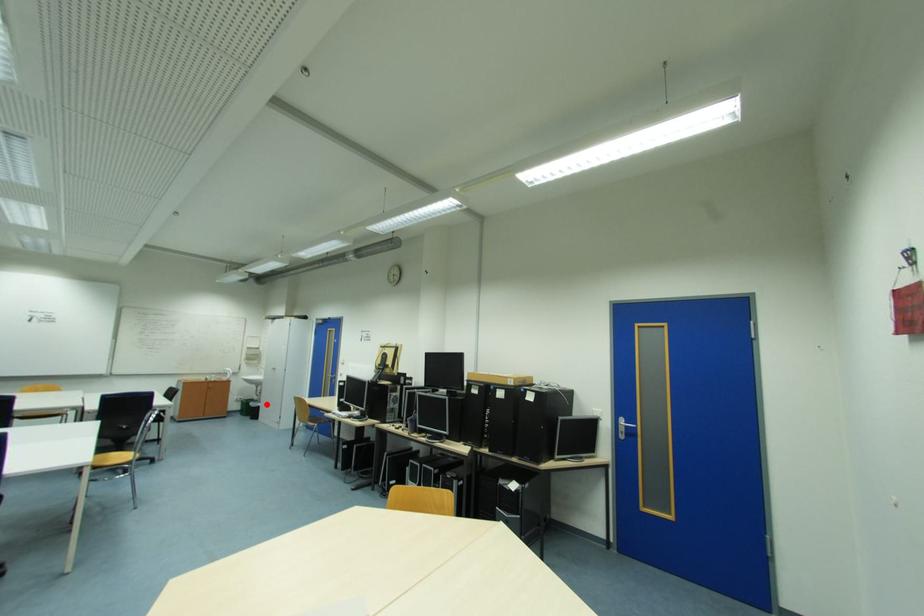
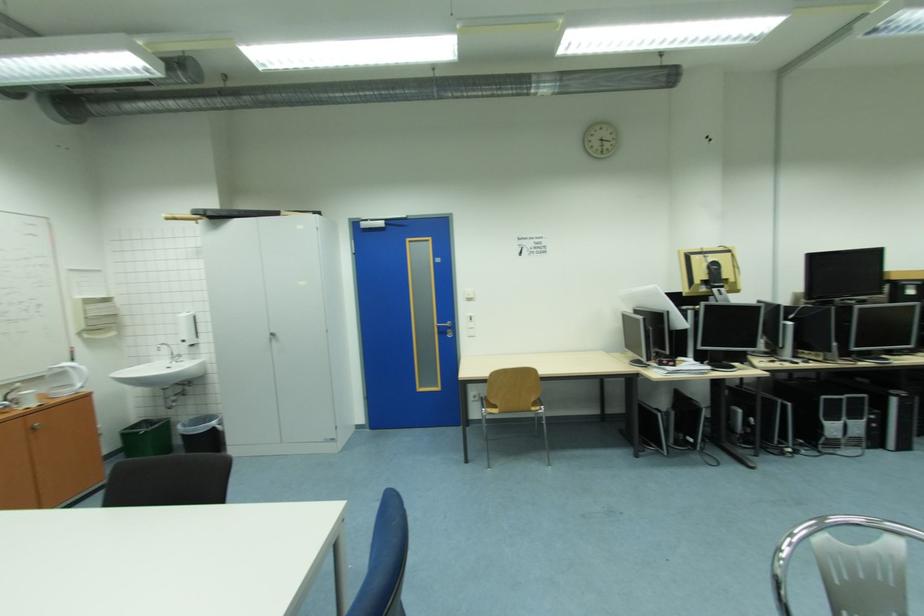
In the second image, find the point that corresponds to the highlighted location in the first image.

(220, 424)